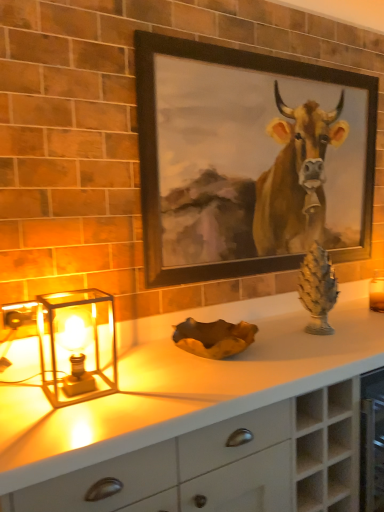
Question: Considering the relative sizes of white matte countertop at center and translucent glass table lamp at left in the image provided, is white matte countertop at center taller than translucent glass table lamp at left?

Choices:
 (A) no
 (B) yes

Answer: (B)

Question: Is white matte countertop at center not inside translucent glass table lamp at left?

Choices:
 (A) yes
 (B) no

Answer: (A)

Question: Is white matte countertop at center closer to the viewer compared to translucent glass table lamp at left?

Choices:
 (A) yes
 (B) no

Answer: (A)

Question: From the image's perspective, is white matte countertop at center beneath translucent glass table lamp at left?

Choices:
 (A) no
 (B) yes

Answer: (B)

Question: Can you confirm if white matte countertop at center is bigger than translucent glass table lamp at left?

Choices:
 (A) no
 (B) yes

Answer: (B)

Question: From the image's perspective, is white matte countertop at center positioned above or below green stone pine cone at right?

Choices:
 (A) below
 (B) above

Answer: (A)

Question: In terms of size, does white matte countertop at center appear bigger or smaller than green stone pine cone at right?

Choices:
 (A) small
 (B) big

Answer: (B)

Question: Considering the positions of point 18,352 and point 316,287, is point 18,352 closer or farther from the camera than point 316,287?

Choices:
 (A) farther
 (B) closer

Answer: (B)

Question: Is white matte countertop at center in front of or behind green stone pine cone at right in the image?

Choices:
 (A) behind
 (B) front

Answer: (B)

Question: From a real-world perspective, is green stone pine cone at right physically located above or below translucent glass table lamp at left?

Choices:
 (A) below
 (B) above

Answer: (B)

Question: In the image, is green stone pine cone at right positioned in front of or behind translucent glass table lamp at left?

Choices:
 (A) front
 (B) behind

Answer: (B)

Question: Considering the positions of green stone pine cone at right and translucent glass table lamp at left in the image, is green stone pine cone at right bigger or smaller than translucent glass table lamp at left?

Choices:
 (A) big
 (B) small

Answer: (B)

Question: Is green stone pine cone at right inside the boundaries of translucent glass table lamp at left, or outside?

Choices:
 (A) outside
 (B) inside

Answer: (A)

Question: From the image's perspective, is translucent glass table lamp at left located above or below white matte countertop at center?

Choices:
 (A) above
 (B) below

Answer: (A)

Question: Is translucent glass table lamp at left taller or shorter than white matte countertop at center?

Choices:
 (A) short
 (B) tall

Answer: (A)